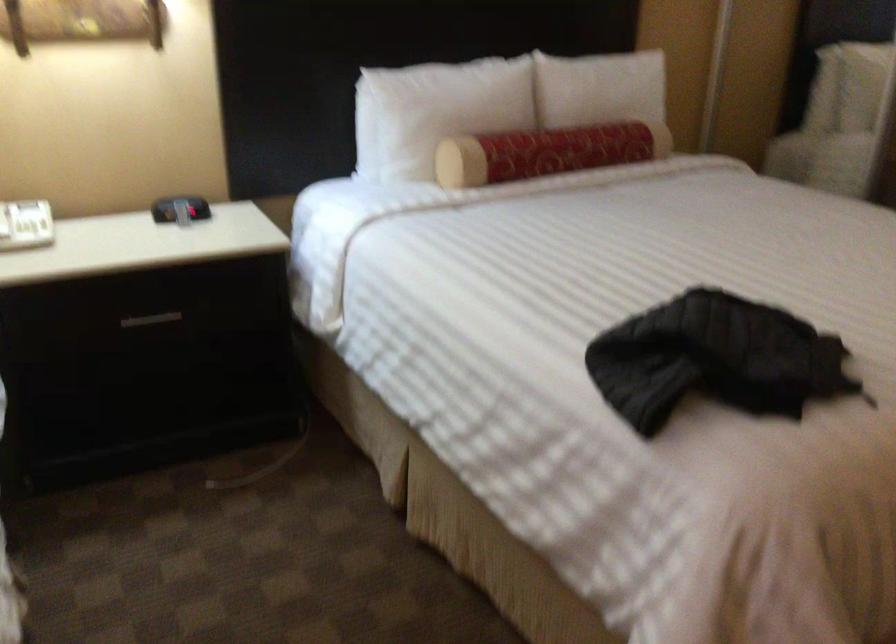
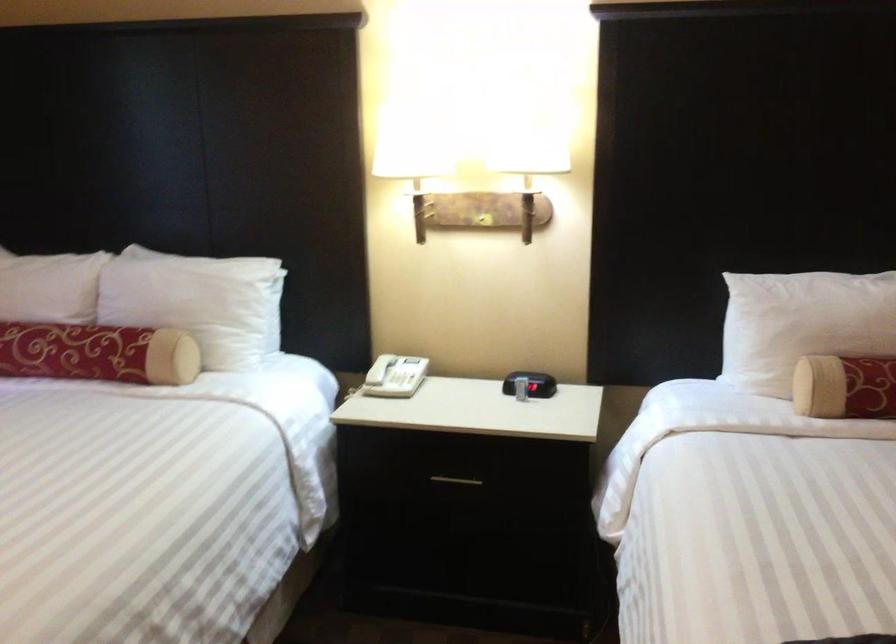
Question: The first image is from the beginning of the video and the second image is from the end. How did the camera likely rotate when shooting the video?

Choices:
 (A) Left
 (B) Right
 (C) Up
 (D) Down

Answer: (A)